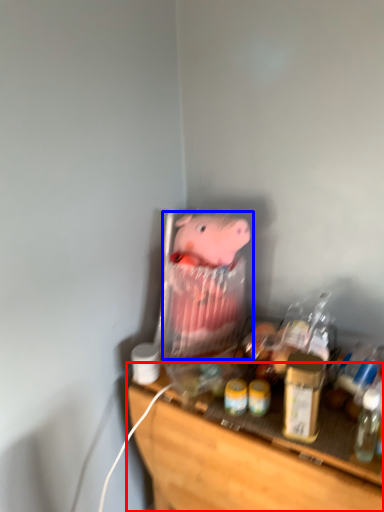
Question: Which point is closer to the camera, furniture (highlighted by a red box) or toy (highlighted by a blue box)?

Choices:
 (A) furniture
 (B) toy

Answer: (A)